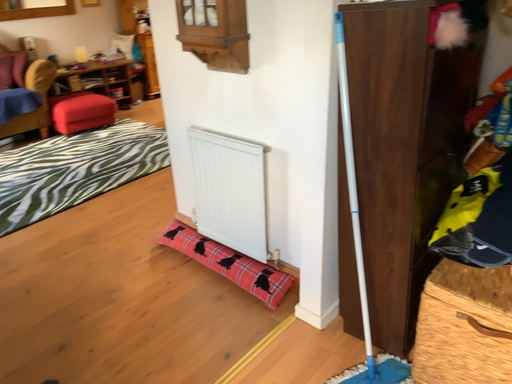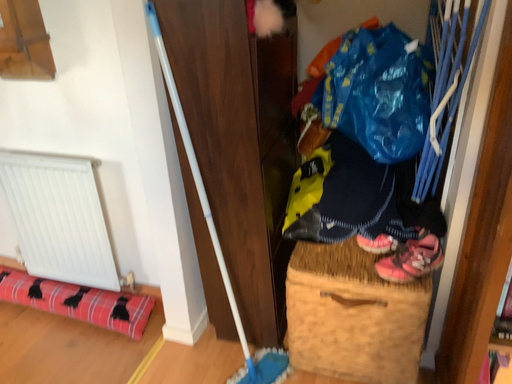
Question: Which way did the camera rotate in the video?

Choices:
 (A) rotated left
 (B) rotated right

Answer: (B)